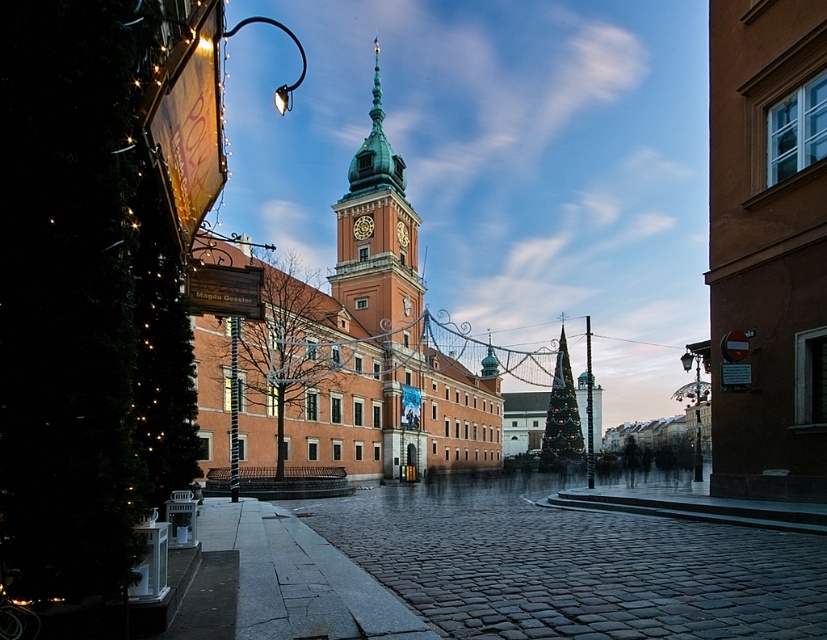
You are standing on the cobblestone street in front of the historic building and want to walk from point A to point B. Point A is located at coordinates point (479, 388) and point B is at point (367, 220). Which direction should you walk to move from point A to point B?

You should walk towards the building because point (479, 388) is further away from the viewer than point (367, 220), so moving from A to B means getting closer to the building.

You are standing on the cobblestone street in front of the historic building. You notice both the green copper clock tower at center and the gold metallic clock at center. Which of these two objects is closer to you?

The green copper clock tower at center is closer to you because it is in front of the gold metallic clock at center.